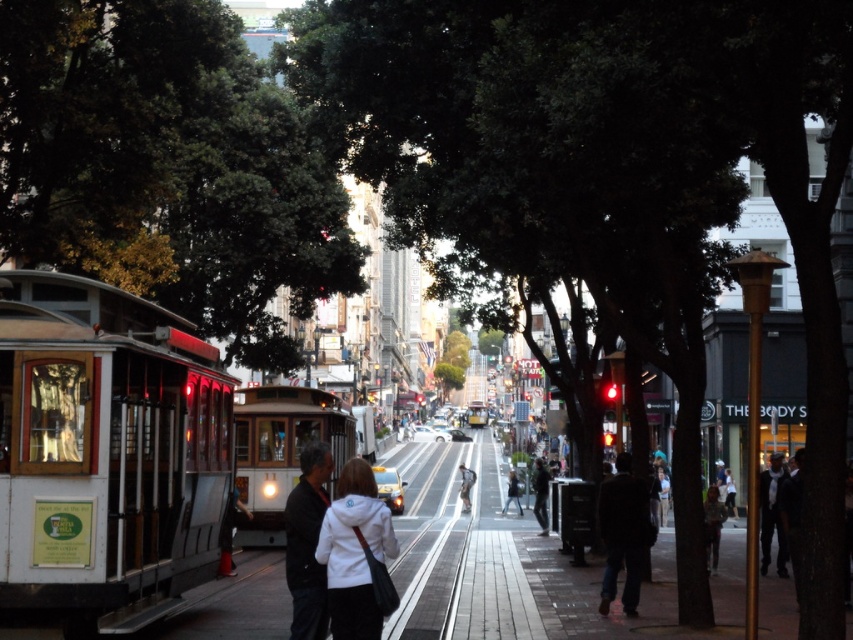
You are a tourist standing on the sidewalk and want to take a photo of the green leafy tree at center without anyone blocking the view. Is the white cotton jacket at center currently in the way?

The green leafy tree at center is positioned over the white cotton jacket at center, so the tree is above the jacket. Since the jacket is below the tree, it might block the view of the tree from your angle on the sidewalk. Move to a position where you can see above the jacket to capture the tree without obstruction.

You are a photographer standing on the sidewalk and want to take a photo of both the dark gray suit at right and the white cotton jacket at center. Which person should you focus on first to ensure both are in sharp focus?

You should focus on the dark gray suit at right first because it is closer to the viewer than the white cotton jacket at center, so adjusting focus from near to far will help both be in sharp focus.

You are a tour guide leading a group and need to point out two people in the scene. The first person is wearing a black fabric jacket at center, and the second is wearing a dark gray suit at right. How far apart are these two individuals from each other?

The black fabric jacket at center and dark gray suit at right are 13.98 meters apart from each other.